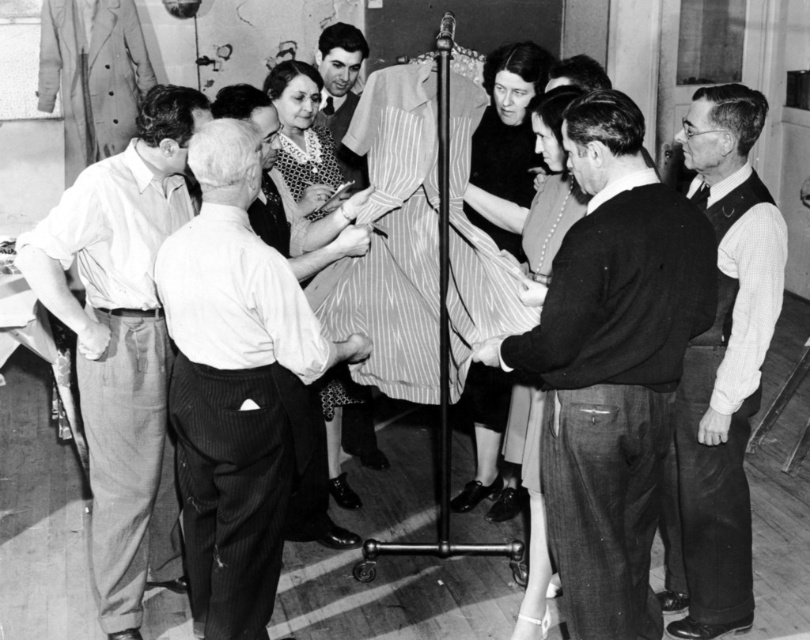
Question: Based on their relative distances, which object is farther from the smooth black shirt at center?

Choices:
 (A) dark gray sweater at center
 (B) black velvet dress at center
 (C) white pinstripe suit at center
 (D) white checkered shirt at right

Answer: (A)

Question: Which of the following is the farthest from the observer?

Choices:
 (A) white checkered shirt at right
 (B) smooth black shirt at center
 (C) polka dot blouse at center
 (D) black velvet dress at center

Answer: (B)

Question: Can you confirm if dark gray sweater at center is positioned below polka dot blouse at center?

Choices:
 (A) no
 (B) yes

Answer: (B)

Question: From the image, what is the correct spatial relationship of white pinstripe suit at center in relation to white checkered shirt at right?

Choices:
 (A) below
 (B) above

Answer: (A)

Question: Which of these objects is positioned farthest from the white checkered shirt at right?

Choices:
 (A) white pinstripe suit at center
 (B) light brown cotton pants at left
 (C) polka dot blouse at center
 (D) smooth black shirt at center

Answer: (B)

Question: From the image, what is the correct spatial relationship of dark gray sweater at center in relation to white checkered shirt at right?

Choices:
 (A) left
 (B) right

Answer: (A)